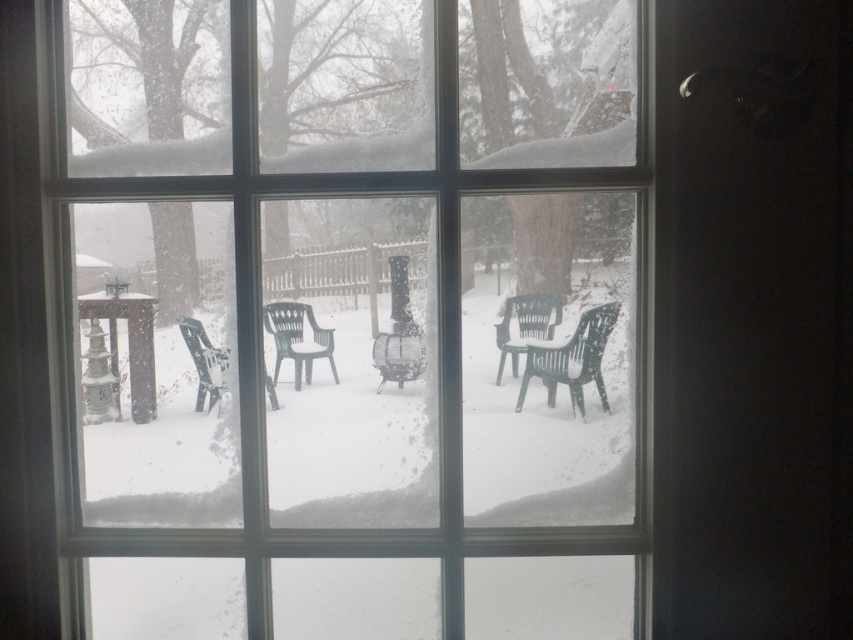
Can you confirm if transparent glass window at center is shorter than green plastic chair at center-right?

No, transparent glass window at center is not shorter than green plastic chair at center-right.

Is transparent glass window at center to the left of green plastic chair at center-right from the viewer's perspective?

Correct, you'll find transparent glass window at center to the left of green plastic chair at center-right.

Which is in front, point (215, 572) or point (573, 396)?

Positioned in front is point (215, 572).

Find the location of `transparent glass window at center`. transparent glass window at center is located at coordinates (354, 307).

Who is more forward, [523,342] or [184,326]?

Point [184,326] is more forward.

Looking at this image, between matte plastic chair at center and green plastic chair at lower left, which one appears on the right side from the viewer's perspective?

matte plastic chair at center is more to the right.

The image size is (853, 640). Describe the element at coordinates (525, 324) in the screenshot. I see `matte plastic chair at center` at that location.

You are a GUI agent. You are given a task and a screenshot of the screen. Output one action in this format:
    pyautogui.click(x=<x>, y=<y>)
    Task: Click on the matte plastic chair at center
    
    Given the screenshot: What is the action you would take?
    pyautogui.click(x=525, y=324)

Does green plastic chair at center-right have a lesser width compared to green plastic chair at lower left?

No, green plastic chair at center-right is not thinner than green plastic chair at lower left.

Who is lower down, green plastic chair at center-right or green plastic chair at lower left?

green plastic chair at lower left is below.

Image resolution: width=853 pixels, height=640 pixels. What are the coordinates of `green plastic chair at center-right` in the screenshot? It's located at pos(572,358).